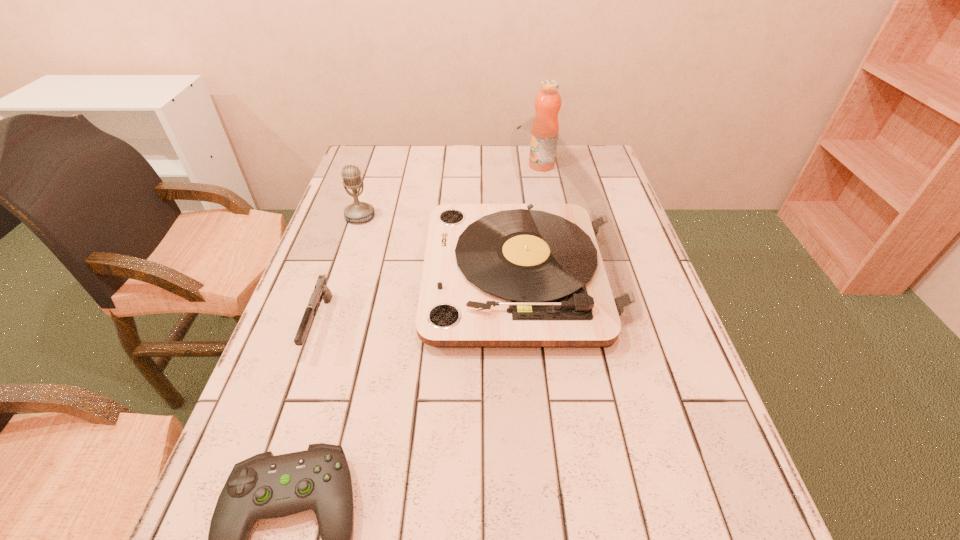
Where is `blank space located at the muzzle end of the second shortest object`? blank space located at the muzzle end of the second shortest object is located at coordinates (262, 496).

The width and height of the screenshot is (960, 540). Find the location of `object that is at the far edge`. object that is at the far edge is located at coordinates (548, 102).

What are the coordinates of `microphone at the left edge` in the screenshot? It's located at (358, 211).

Identify the location of gun that is at the left edge. (321, 291).

The height and width of the screenshot is (540, 960). In order to click on object that is at the right edge in this screenshot , I will do `click(552, 273)`.

I want to click on free space at the far edge, so click(416, 145).

Locate an element on the screen. The height and width of the screenshot is (540, 960). free point at the left edge is located at coordinates (259, 417).

You are a GUI agent. You are given a task and a screenshot of the screen. Output one action in this format:
    pyautogui.click(x=<x>, y=<y>)
    Task: Click on the free space at the right edge of the desktop
    The image size is (960, 540).
    Given the screenshot: What is the action you would take?
    pyautogui.click(x=636, y=336)

This screenshot has height=540, width=960. I want to click on blank area at the far left corner, so click(x=377, y=162).

Where is `vacant space at the near left corner of the desktop`? This screenshot has height=540, width=960. vacant space at the near left corner of the desktop is located at coordinates (287, 539).